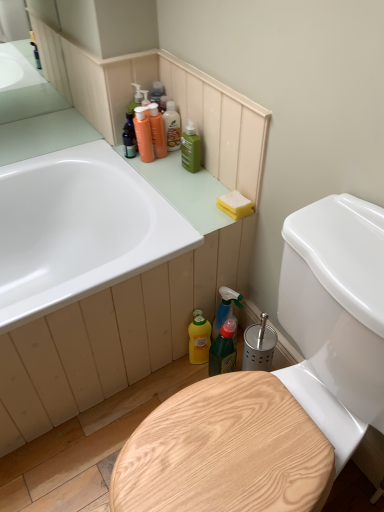
Describe the element at coordinates (143, 135) in the screenshot. I see `matte orange bottles at upper left, marked as the 4th cleaning product in a bottom-to-top arrangement` at that location.

What are the coordinates of `translucent orange bottle at upper center, arranged as the fifth cleaning product when ordered from the bottom` in the screenshot? It's located at (157, 131).

At what (x,y) coordinates should I click in order to perform the action: click on wooden at lower right. Please return your answer as a coordinate pair (x, y). The height and width of the screenshot is (512, 384). Looking at the image, I should click on (336, 317).

Find the location of a particular element. yellow matte bottle at lower center, which is counted as the 6th cleaning product, starting from the top is located at coordinates (199, 340).

Image resolution: width=384 pixels, height=512 pixels. What do you see at coordinates (226, 310) in the screenshot? I see `translucent green spray bottle at lower right, which ranks as the 5th cleaning product in top-to-bottom order` at bounding box center [226, 310].

Locate an element on the screen. yellow sponge at upper right is located at coordinates (235, 204).

Find the location of a particular element. This screenshot has width=384, height=512. translucent amber bottle at upper center, which is the sixth cleaning product from bottom to top is located at coordinates (172, 127).

Relative to wooden at lower right, is matte orange bottles at upper left, marked as the 4th cleaning product in a bottom-to-top arrangement, in front or behind?

matte orange bottles at upper left, marked as the 4th cleaning product in a bottom-to-top arrangement, is positioned farther from the viewer than wooden at lower right.

Is there a large distance between matte orange bottles at upper left, which ranks as the 3th cleaning product in top-to-bottom order, and wooden at lower right?

That's not correct — matte orange bottles at upper left, which ranks as the 3th cleaning product in top-to-bottom order, is a little close to wooden at lower right.

From the picture: Is matte orange bottles at upper left, marked as the 4th cleaning product in a bottom-to-top arrangement, oriented towards wooden at lower right?

No, matte orange bottles at upper left, marked as the 4th cleaning product in a bottom-to-top arrangement, does not turn towards wooden at lower right.

Which is in front, green matte bottle at upper center, the 4th cleaning product positioned from the top, or yellow sponge at upper right?

yellow sponge at upper right is more forward.

Considering the positions of points (195, 166) and (235, 207), is point (195, 166) farther from camera compared to point (235, 207)?

That is True.

Does green matte bottle at upper center, which is the third cleaning product from bottom to top, have a greater width compared to yellow sponge at upper right?

No, green matte bottle at upper center, which is the third cleaning product from bottom to top, is not wider than yellow sponge at upper right.

The width and height of the screenshot is (384, 512). Find the location of `soap below the green matte bottle at upper center, which is the third cleaning product from bottom to top (from a real-world perspective)`. soap below the green matte bottle at upper center, which is the third cleaning product from bottom to top (from a real-world perspective) is located at coordinates (235, 204).

In the scene shown: Considering the sizes of objects yellow sponge at upper right and yellow matte bottle at lower center, the first cleaning product when ordered from bottom to top, in the image provided, who is taller, yellow sponge at upper right or yellow matte bottle at lower center, the first cleaning product when ordered from bottom to top,?

yellow matte bottle at lower center, the first cleaning product when ordered from bottom to top, is taller.

Which of these two, yellow sponge at upper right or yellow matte bottle at lower center, the first cleaning product when ordered from bottom to top, is wider?

yellow sponge at upper right.

In the scene shown: Between yellow sponge at upper right and yellow matte bottle at lower center, which is counted as the 6th cleaning product, starting from the top, which one is positioned in front?

yellow sponge at upper right is closer to the camera.

Between yellow sponge at upper right and yellow matte bottle at lower center, which is counted as the 6th cleaning product, starting from the top, which one has smaller size?

Smaller between the two is yellow sponge at upper right.

From a real-world perspective, does green matte bottle at upper center, the 4th cleaning product positioned from the top, stand above translucent orange bottle at upper center, acting as the second cleaning product starting from the top?

No, from a real-world perspective, green matte bottle at upper center, the 4th cleaning product positioned from the top, is not on top of translucent orange bottle at upper center, acting as the second cleaning product starting from the top.

Between green matte bottle at upper center, which is the third cleaning product from bottom to top, and translucent orange bottle at upper center, arranged as the fifth cleaning product when ordered from the bottom, which one has smaller size?

translucent orange bottle at upper center, arranged as the fifth cleaning product when ordered from the bottom, is smaller.

Considering the sizes of objects green matte bottle at upper center, which is the third cleaning product from bottom to top, and translucent orange bottle at upper center, acting as the second cleaning product starting from the top, in the image provided, who is wider, green matte bottle at upper center, which is the third cleaning product from bottom to top, or translucent orange bottle at upper center, acting as the second cleaning product starting from the top,?

translucent orange bottle at upper center, acting as the second cleaning product starting from the top, is wider.

From the image's perspective, is green matte bottle at upper center, which is the third cleaning product from bottom to top, located beneath translucent orange bottle at upper center, acting as the second cleaning product starting from the top?

Yes.

Which point is more distant from viewer, (224,320) or (237,202)?

The point (224,320) is farther from the camera.

Does translucent green spray bottle at lower right, which ranks as the 5th cleaning product in top-to-bottom order, turn towards yellow sponge at upper right?

No, translucent green spray bottle at lower right, which ranks as the 5th cleaning product in top-to-bottom order, does not turn towards yellow sponge at upper right.

Measure the distance between translucent green spray bottle at lower right, which ranks as the 5th cleaning product in top-to-bottom order, and yellow sponge at upper right.

They are 33.36 centimeters apart.

Based on the photo, between translucent green spray bottle at lower right, which ranks as the 5th cleaning product in top-to-bottom order, and yellow sponge at upper right, which one has less height?

yellow sponge at upper right is shorter.

Which of these two, green plastic spray bottle at lower center or yellow sponge at upper right, is wider?

green plastic spray bottle at lower center.

From a real-world perspective, who is located lower, green plastic spray bottle at lower center or yellow sponge at upper right?

green plastic spray bottle at lower center.

Is green plastic spray bottle at lower center oriented towards yellow sponge at upper right?

No, green plastic spray bottle at lower center is not aimed at yellow sponge at upper right.

Looking at the image, does wooden at lower right seem bigger or smaller compared to translucent amber bottle at upper center, which is the sixth cleaning product from bottom to top?

wooden at lower right is bigger than translucent amber bottle at upper center, which is the sixth cleaning product from bottom to top.

You are a GUI agent. You are given a task and a screenshot of the screen. Output one action in this format:
    pyautogui.click(x=<x>, y=<y>)
    Task: Click on the toilet that appears in front of the translucent amber bottle at upper center, the first cleaning product from the top
    Image resolution: width=384 pixels, height=512 pixels.
    Given the screenshot: What is the action you would take?
    [336, 317]

From a real-world perspective, which is physically below, wooden at lower right or translucent amber bottle at upper center, the first cleaning product from the top?

wooden at lower right is physically lower.

From the image's perspective, is wooden at lower right beneath translucent amber bottle at upper center, the first cleaning product from the top?

Yes, from the image's perspective, wooden at lower right is beneath translucent amber bottle at upper center, the first cleaning product from the top.

Identify the location of toilet below the matte orange bottles at upper left, marked as the 4th cleaning product in a bottom-to-top arrangement (from the image's perspective). The image size is (384, 512). (336, 317).

I want to click on soap on the right of green matte bottle at upper center, which is the third cleaning product from bottom to top, so click(x=235, y=204).

From the image, which object appears to be nearer to yellow matte bottle at lower center, which is counted as the 6th cleaning product, starting from the top, translucent amber bottle at upper center, which is the sixth cleaning product from bottom to top, or translucent green spray bottle at lower right, which ranks as the 5th cleaning product in top-to-bottom order?

translucent green spray bottle at lower right, which ranks as the 5th cleaning product in top-to-bottom order.

Estimate the real-world distances between objects in this image. Which object is further from yellow matte bottle at lower center, the first cleaning product when ordered from bottom to top, translucent amber bottle at upper center, which is the sixth cleaning product from bottom to top, or matte orange bottles at upper left, marked as the 4th cleaning product in a bottom-to-top arrangement?

The object further to yellow matte bottle at lower center, the first cleaning product when ordered from bottom to top, is translucent amber bottle at upper center, which is the sixth cleaning product from bottom to top.

Looking at the image, which one is located closer to green plastic spray bottle at lower center, translucent amber bottle at upper center, the first cleaning product from the top, or wooden at lower right?

wooden at lower right is positioned closer to the anchor green plastic spray bottle at lower center.

Estimate the real-world distances between objects in this image. Which object is further from yellow matte bottle at lower center, which is counted as the 6th cleaning product, starting from the top, green plastic spray bottle at lower center or translucent amber bottle at upper center, the first cleaning product from the top?

translucent amber bottle at upper center, the first cleaning product from the top, lies further to yellow matte bottle at lower center, which is counted as the 6th cleaning product, starting from the top, than the other object.

Which object lies nearer to the anchor point translucent orange bottle at upper center, acting as the second cleaning product starting from the top, matte orange bottles at upper left, which ranks as the 3th cleaning product in top-to-bottom order, or translucent green spray bottle at lower right, which appears as the 2th cleaning product when ordered from the bottom?

matte orange bottles at upper left, which ranks as the 3th cleaning product in top-to-bottom order, is positioned closer to the anchor translucent orange bottle at upper center, acting as the second cleaning product starting from the top.

Estimate the real-world distances between objects in this image. Which object is further from translucent green spray bottle at lower right, which appears as the 2th cleaning product when ordered from the bottom, green matte bottle at upper center, which is the third cleaning product from bottom to top, or translucent orange bottle at upper center, acting as the second cleaning product starting from the top?

Among the two, translucent orange bottle at upper center, acting as the second cleaning product starting from the top, is located further to translucent green spray bottle at lower right, which appears as the 2th cleaning product when ordered from the bottom.

Based on their spatial positions, is translucent amber bottle at upper center, the first cleaning product from the top, or yellow sponge at upper right closer to wooden at lower right?

yellow sponge at upper right is closer to wooden at lower right.

Estimate the real-world distances between objects in this image. Which object is further from yellow sponge at upper right, wooden at lower right or yellow matte bottle at lower center, which is counted as the 6th cleaning product, starting from the top?

Among the two, wooden at lower right is located further to yellow sponge at upper right.

At what (x,y) coordinates should I click in order to perform the action: click on soap between wooden at lower right and yellow matte bottle at lower center, which is counted as the 6th cleaning product, starting from the top, along the z-axis. Please return your answer as a coordinate pair (x, y). Looking at the image, I should click on (235, 204).

Where is `soap between green matte bottle at upper center, the 4th cleaning product positioned from the top, and yellow matte bottle at lower center, which is counted as the 6th cleaning product, starting from the top, from top to bottom`? soap between green matte bottle at upper center, the 4th cleaning product positioned from the top, and yellow matte bottle at lower center, which is counted as the 6th cleaning product, starting from the top, from top to bottom is located at coordinates (235, 204).

This screenshot has height=512, width=384. What are the coordinates of `cleaning product between matte orange bottles at upper left, which ranks as the 3th cleaning product in top-to-bottom order, and translucent amber bottle at upper center, which is the sixth cleaning product from bottom to top` in the screenshot? It's located at (157, 131).

At what (x,y) coordinates should I click in order to perform the action: click on soap that lies between translucent orange bottle at upper center, acting as the second cleaning product starting from the top, and yellow matte bottle at lower center, the first cleaning product when ordered from bottom to top, from top to bottom. Please return your answer as a coordinate pair (x, y). This screenshot has width=384, height=512. Looking at the image, I should click on (235, 204).